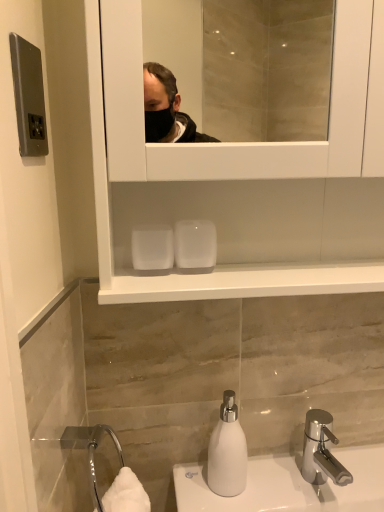
What do you see at coordinates (321, 450) in the screenshot? The width and height of the screenshot is (384, 512). I see `polished chrome faucet at lower right` at bounding box center [321, 450].

The width and height of the screenshot is (384, 512). I want to click on polished chrome faucet at lower right, so click(321, 450).

Where is `white matte soap dispenser at lower center`? white matte soap dispenser at lower center is located at coordinates (227, 451).

What do you see at coordinates (227, 451) in the screenshot? The image size is (384, 512). I see `white matte soap dispenser at lower center` at bounding box center [227, 451].

What are the coordinates of `polished chrome faucet at lower right` in the screenshot? It's located at (321, 450).

Can you confirm if polished chrome faucet at lower right is positioned to the left of white matte soap dispenser at lower center?

A: Incorrect, polished chrome faucet at lower right is not on the left side of white matte soap dispenser at lower center.

Which object is further away from the camera taking this photo, polished chrome faucet at lower right or white matte soap dispenser at lower center?

white matte soap dispenser at lower center is further from the camera.

Which is farther, [316,467] or [217,461]?

The point [316,467] is farther from the camera.

Looking at this image, from the image's perspective, is polished chrome faucet at lower right above white matte soap dispenser at lower center?

No, from the image's perspective, polished chrome faucet at lower right is not above white matte soap dispenser at lower center.

From a real-world perspective, is polished chrome faucet at lower right physically located above or below white matte soap dispenser at lower center?

Clearly, from a real-world perspective, polished chrome faucet at lower right is below white matte soap dispenser at lower center.

Between polished chrome faucet at lower right and white matte soap dispenser at lower center, which one has smaller width?

Thinner between the two is white matte soap dispenser at lower center.

Between polished chrome faucet at lower right and white matte soap dispenser at lower center, which one has more height?

With more height is white matte soap dispenser at lower center.

Does polished chrome faucet at lower right have a larger size compared to white matte soap dispenser at lower center?

Yes, polished chrome faucet at lower right is bigger than white matte soap dispenser at lower center.

Do you think polished chrome faucet at lower right is within white matte soap dispenser at lower center, or outside of it?

polished chrome faucet at lower right lies outside white matte soap dispenser at lower center.

Is polished chrome faucet at lower right not close to white matte soap dispenser at lower center?

polished chrome faucet at lower right is actually quite close to white matte soap dispenser at lower center.

Is polished chrome faucet at lower right looking in the opposite direction of white matte soap dispenser at lower center?

No, white matte soap dispenser at lower center is not at the back of polished chrome faucet at lower right.

Can you tell me how much polished chrome faucet at lower right and white matte soap dispenser at lower center differ in facing direction?

The angular difference between polished chrome faucet at lower right and white matte soap dispenser at lower center is 0.000144 degrees.

Looking at this image, how far apart are polished chrome faucet at lower right and white matte soap dispenser at lower center?

They are 6.24 inches apart.

Locate an element on the screen. The width and height of the screenshot is (384, 512). soap dispenser located above the polished chrome faucet at lower right (from a real-world perspective) is located at coordinates (227, 451).

Would you say white matte soap dispenser at lower center is to the left or to the right of polished chrome faucet at lower right in the picture?

In the image, white matte soap dispenser at lower center appears on the left side of polished chrome faucet at lower right.

Considering the positions of objects white matte soap dispenser at lower center and polished chrome faucet at lower right in the image provided, who is behind, white matte soap dispenser at lower center or polished chrome faucet at lower right?

white matte soap dispenser at lower center is further away from the camera.

Is point (224, 450) closer or farther from the camera than point (311, 418)?

Clearly, point (224, 450) is closer to the camera than point (311, 418).

From the image's perspective, is white matte soap dispenser at lower center above polished chrome faucet at lower right?

Correct, white matte soap dispenser at lower center appears higher than polished chrome faucet at lower right in the image.

From a real-world perspective, which object rests below the other?

polished chrome faucet at lower right.

In the scene shown: Which object is thinner, white matte soap dispenser at lower center or polished chrome faucet at lower right?

Thinner between the two is white matte soap dispenser at lower center.

Which of these two, white matte soap dispenser at lower center or polished chrome faucet at lower right, stands shorter?

polished chrome faucet at lower right is shorter.

Considering the sizes of objects white matte soap dispenser at lower center and polished chrome faucet at lower right in the image provided, who is smaller, white matte soap dispenser at lower center or polished chrome faucet at lower right?

white matte soap dispenser at lower center.

Can we say white matte soap dispenser at lower center lies outside polished chrome faucet at lower right?

Yes, white matte soap dispenser at lower center is outside of polished chrome faucet at lower right.

Is white matte soap dispenser at lower center not near polished chrome faucet at lower right?

No, white matte soap dispenser at lower center is not far away from polished chrome faucet at lower right.

Is polished chrome faucet at lower right at the back of white matte soap dispenser at lower center?

No, white matte soap dispenser at lower center's orientation is not away from polished chrome faucet at lower right.

How many degrees apart are the facing directions of white matte soap dispenser at lower center and polished chrome faucet at lower right?

The facing directions of white matte soap dispenser at lower center and polished chrome faucet at lower right are 0.000144 degrees apart.

This screenshot has height=512, width=384. In order to click on soap dispenser located behind the polished chrome faucet at lower right in this screenshot , I will do `click(227, 451)`.

Find the location of `tap that appears on the right of white matte soap dispenser at lower center`. tap that appears on the right of white matte soap dispenser at lower center is located at coordinates (321, 450).

Where is `tap in front of the white matte soap dispenser at lower center`? tap in front of the white matte soap dispenser at lower center is located at coordinates [x=321, y=450].